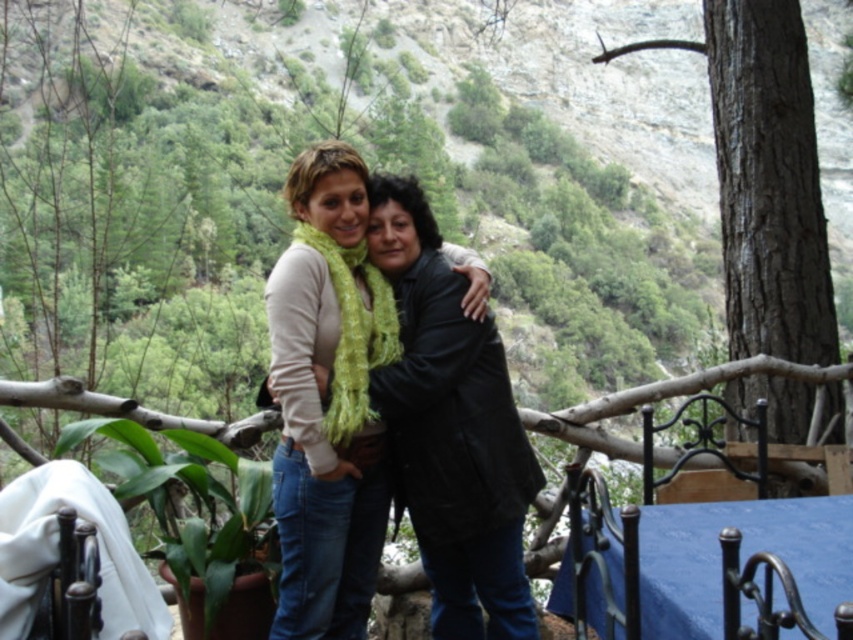
You are a photographer setting up a shoot in this outdoor scene. You need to decide which item, the light beige sweater at center or the blue fabric tablecloth at lower right, would be better suited to cover a larger surface area for a prop. Which one should you choose?

The light beige sweater at center is larger in size than the blue fabric tablecloth at lower right, so it would be better suited to cover a larger surface area for a prop.

Consider the image. You are setting up a picnic and need to place a basket between the light beige sweater at center and the blue fabric tablecloth at lower right. Based on their positions, where should you place the basket?

The basket should be placed between the light beige sweater at center and the blue fabric tablecloth at lower right, as the light beige sweater at center is to the left of the blue fabric tablecloth at lower right.

You are standing at the point with coordinates point (714,561) and want to walk to the point with coordinates point (471,580). Is the destination point in front of or behind you?

The destination point point (471,580) is behind point (714,561), so it is behind you.